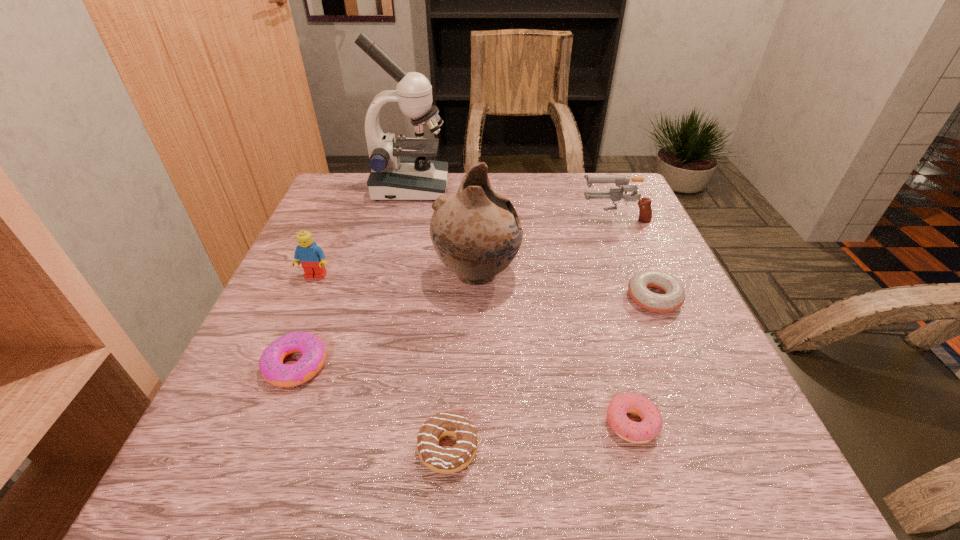
Where is `the farthest object`? Image resolution: width=960 pixels, height=540 pixels. the farthest object is located at coordinates (396, 175).

At what (x,y) coordinates should I click in order to perform the action: click on the tallest object. Please return your answer as a coordinate pair (x, y). Looking at the image, I should click on click(x=396, y=175).

You are a GUI agent. You are given a task and a screenshot of the screen. Output one action in this format:
    pyautogui.click(x=<x>, y=<y>)
    Task: Click on the pottery
    This screenshot has width=960, height=540.
    Given the screenshot: What is the action you would take?
    pyautogui.click(x=476, y=232)

In order to click on the seventh nearest object in this screenshot , I will do `click(645, 211)`.

Where is `Lego`? Image resolution: width=960 pixels, height=540 pixels. Lego is located at coordinates (311, 257).

This screenshot has height=540, width=960. What are the coordinates of `the rightmost doughnut` in the screenshot? It's located at (674, 297).

This screenshot has height=540, width=960. In order to click on the sixth farthest object in this screenshot , I will do `click(273, 370)`.

The width and height of the screenshot is (960, 540). Identify the location of the second farthest doughnut. (273, 370).

I want to click on the second doughnut from left to right, so click(454, 459).

Where is `the shortest object`? the shortest object is located at coordinates (641, 432).